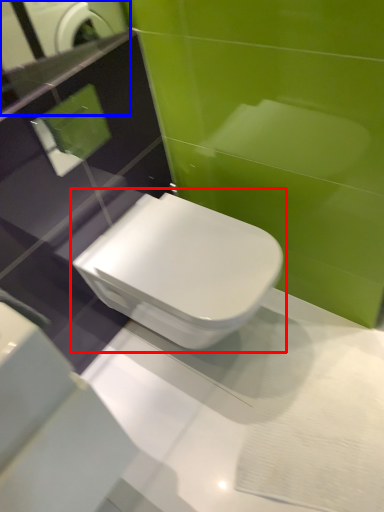
Question: Which point is further to the camera, toilet (highlighted by a red box) or mirror (highlighted by a blue box)?

Choices:
 (A) toilet
 (B) mirror

Answer: (A)